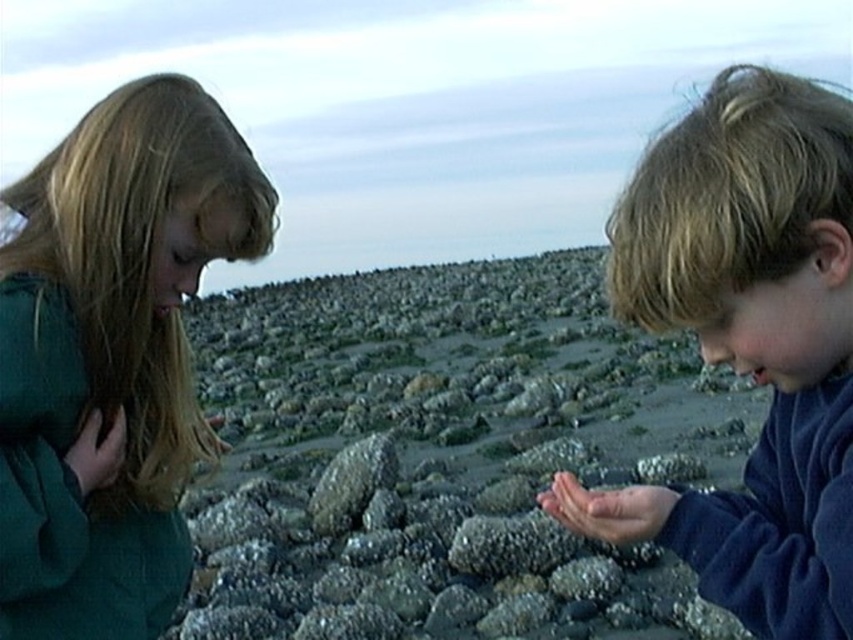
You are a photographer trying to capture a closeup of the smooth brown hair at center. You are currently positioned at point A, which is at the bottom left corner of the image. To get the best shot, you need to move towards the point marked as point (749,342). In which general direction should you move from your current position to reach that point?

To reach point (749,342) from the bottom left corner, you should move diagonally towards the upper right direction since the point is located at the center of the image relative to the bottom left starting position.

You are a photographer trying to capture a clear photo of the green matte shirt at left without the smooth gray rocks at center blocking it. What should you do?

Move the camera backward so that the green matte shirt at left comes into focus while moving the smooth gray rocks at center out of the way.